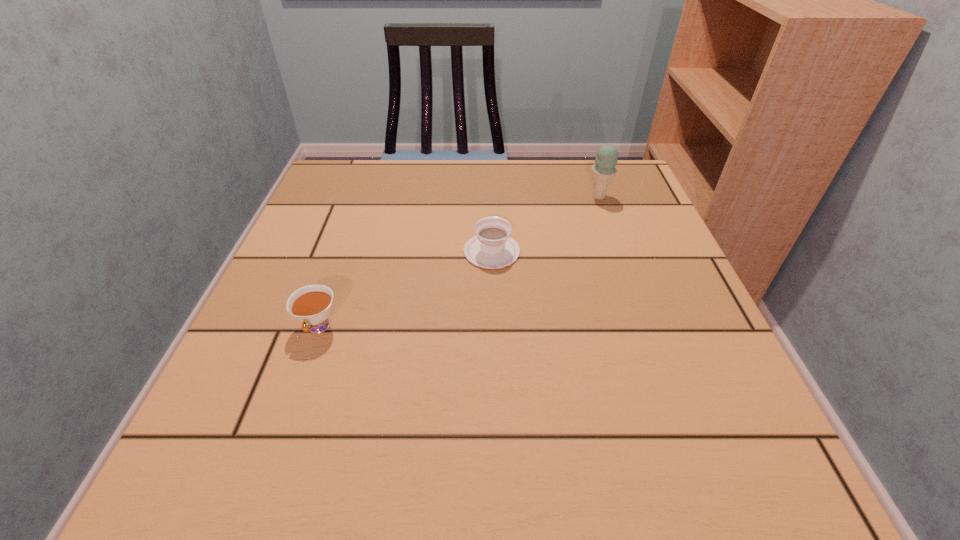
Find the location of a particular element. This screenshot has height=540, width=960. vacant space at the far right corner of the desktop is located at coordinates (571, 174).

In the image, there is a desktop. Identify the location of free region at the near right corner. The width and height of the screenshot is (960, 540). (729, 452).

The width and height of the screenshot is (960, 540). I want to click on free space between the left teacup and the rightmost object, so click(459, 262).

You are a GUI agent. You are given a task and a screenshot of the screen. Output one action in this format:
    pyautogui.click(x=<x>, y=<y>)
    Task: Click on the vacant space that's between the right teacup and the nearest object
    
    Given the screenshot: What is the action you would take?
    pyautogui.click(x=405, y=289)

The image size is (960, 540). In order to click on empty space that is in between the left teacup and the farther teacup in this screenshot , I will do `click(405, 289)`.

In order to click on free spot between the leftmost object and the tallest object in this screenshot , I will do coord(459,262).

You are a GUI agent. You are given a task and a screenshot of the screen. Output one action in this format:
    pyautogui.click(x=<x>, y=<y>)
    Task: Click on the empty space between the ice cream and the right teacup
    The width and height of the screenshot is (960, 540).
    Given the screenshot: What is the action you would take?
    pyautogui.click(x=545, y=224)

This screenshot has width=960, height=540. Find the location of `vacant point located between the leftmost object and the rightmost object`. vacant point located between the leftmost object and the rightmost object is located at coordinates (459, 262).

I want to click on blank region between the tallest object and the second nearest object, so click(545, 224).

The width and height of the screenshot is (960, 540). I want to click on unoccupied position between the ice cream and the left teacup, so click(459, 262).